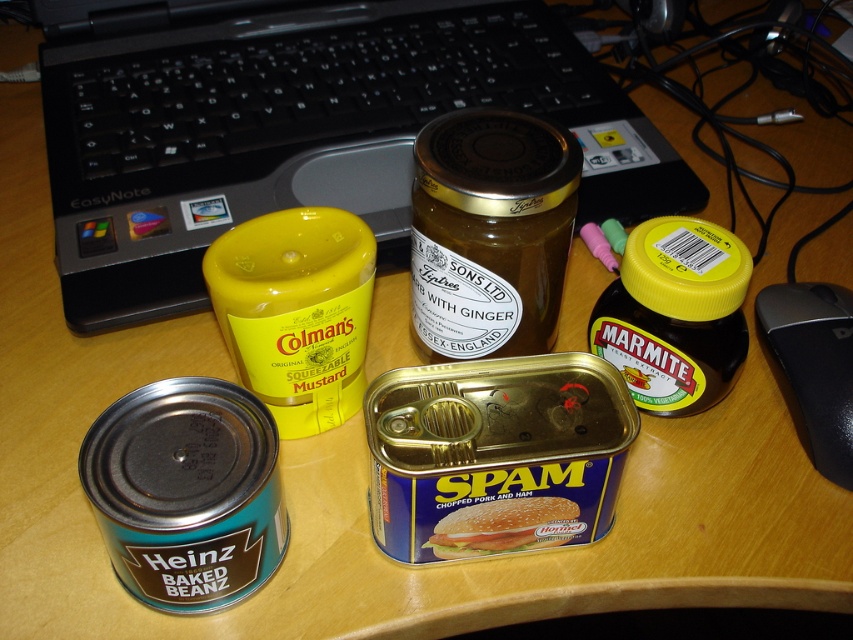
Question: Which of the following is the farthest from the observer?

Choices:
 (A) (445, 337)
 (B) (833, 412)
 (C) (135, 99)

Answer: (C)

Question: Which of the following is the farthest from the observer?

Choices:
 (A) (584, 147)
 (B) (463, 532)

Answer: (A)

Question: Which object appears closest to the camera in this image?

Choices:
 (A) gold glass jar of ginger at center
 (B) black plastic mouse at right
 (C) blue metallic can at center
 (D) black plastic laptop at upper left

Answer: (C)

Question: Is black plastic laptop at upper left smaller than black plastic mouse at right?

Choices:
 (A) yes
 (B) no

Answer: (B)

Question: Can you confirm if gold glass jar of ginger at center is smaller than black plastic mouse at right?

Choices:
 (A) no
 (B) yes

Answer: (A)

Question: Is black plastic laptop at upper left thinner than black plastic mouse at right?

Choices:
 (A) yes
 (B) no

Answer: (B)